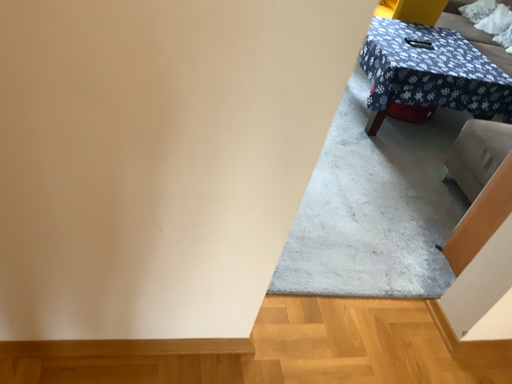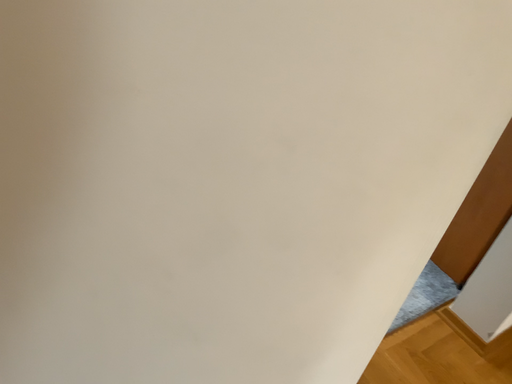
Question: How did the camera likely rotate when shooting the video?

Choices:
 (A) rotated left
 (B) rotated right

Answer: (B)